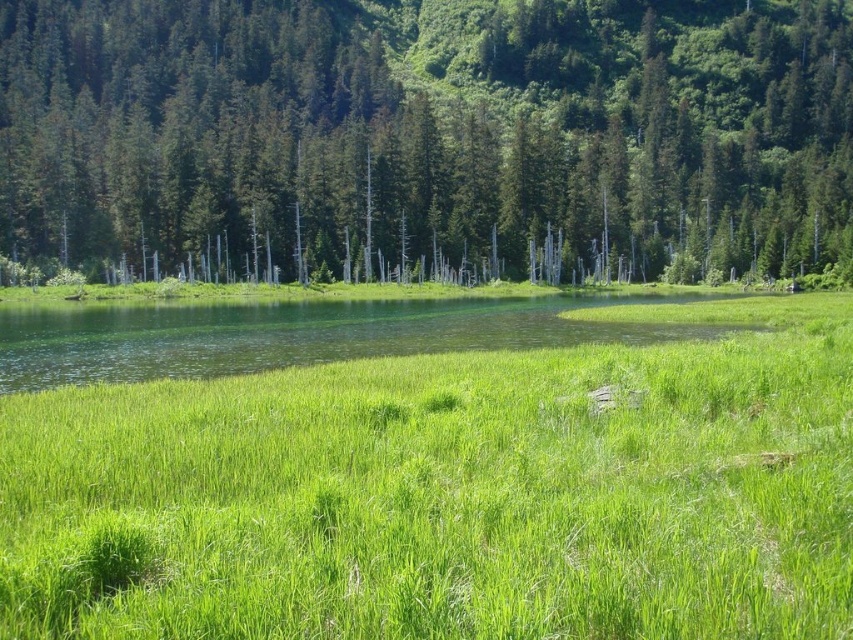
Question: Can you confirm if green grassy at center is smaller than clear water at center?

Choices:
 (A) yes
 (B) no

Answer: (A)

Question: Among these points, which one is farthest from the camera?

Choices:
 (A) (21, 384)
 (B) (51, 188)
 (C) (795, 618)

Answer: (B)

Question: Among these points, which one is farthest from the camera?

Choices:
 (A) (119, 492)
 (B) (270, 330)
 (C) (734, 88)

Answer: (C)

Question: Which point is farther from the camera taking this photo?

Choices:
 (A) (328, 113)
 (B) (376, 352)
 (C) (302, 397)

Answer: (A)

Question: Is green grassy at center thinner than green matte tree at center?

Choices:
 (A) no
 (B) yes

Answer: (B)

Question: Is green grassy at center positioned behind green matte tree at center?

Choices:
 (A) no
 (B) yes

Answer: (A)